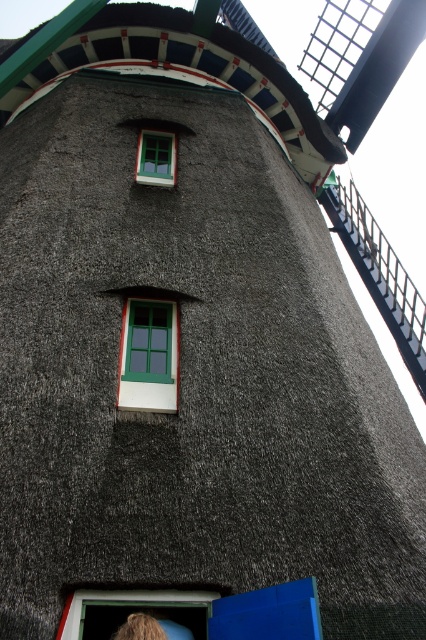
Question: Which object appears closest to the camera in this image?

Choices:
 (A) green wooden window at upper center
 (B) thatched straw roof at upper center

Answer: (A)

Question: Considering the real-world distances, which object is closest to the green matte window at center?

Choices:
 (A) green wooden window at upper center
 (B) thatched straw roof at upper center

Answer: (A)

Question: Where is thatched straw roof at upper center located in relation to green matte window at center in the image?

Choices:
 (A) above
 (B) below

Answer: (A)

Question: Which of the following is the closest to the observer?

Choices:
 (A) thatched straw roof at upper center
 (B) green matte window at center
 (C) green wooden window at upper center

Answer: (B)

Question: Is thatched straw roof at upper center smaller than green wooden window at upper center?

Choices:
 (A) no
 (B) yes

Answer: (A)

Question: Can you confirm if thatched straw roof at upper center is positioned above green wooden window at upper center?

Choices:
 (A) no
 (B) yes

Answer: (B)